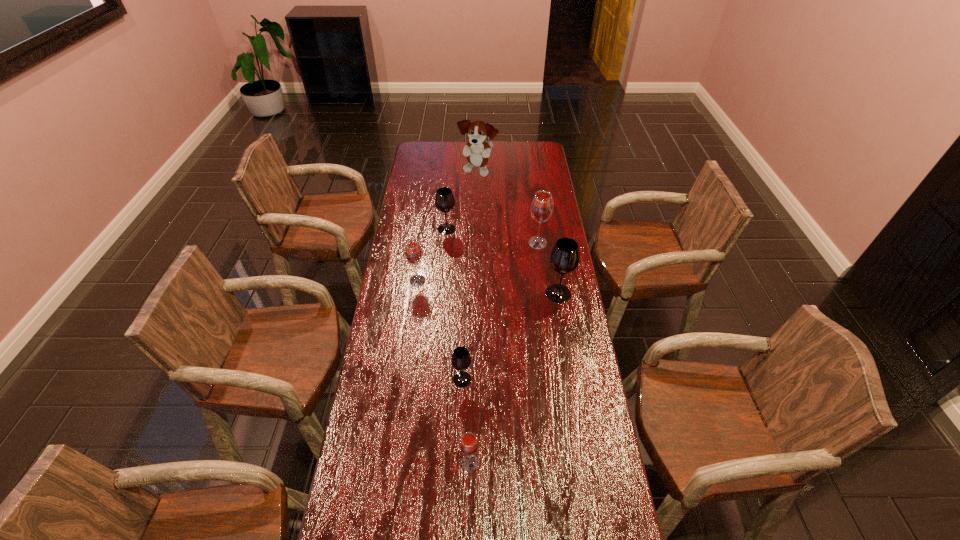
Locate an element on the screen. puppy is located at coordinates (477, 150).

Identify the location of brown puppy. The image size is (960, 540). (477, 150).

Locate an element on the screen. This screenshot has height=540, width=960. the fifth nearest object is located at coordinates (542, 205).

At what (x,y) coordinates should I click in order to perform the action: click on the second farthest wineglass. Please return your answer as a coordinate pair (x, y). The image size is (960, 540). Looking at the image, I should click on (542, 205).

At what (x,y) coordinates should I click in order to perform the action: click on the rightmost gray wineglass. Please return your answer as a coordinate pair (x, y). The image size is (960, 540). Looking at the image, I should click on (564, 258).

Find the location of a particular element. The height and width of the screenshot is (540, 960). the biggest gray wineglass is located at coordinates (564, 258).

The width and height of the screenshot is (960, 540). I want to click on the second smallest red wineglass, so click(x=413, y=252).

Identify the location of the leftmost red wineglass. (413, 252).

I want to click on the second wineglass from left to right, so click(x=444, y=200).

Where is `the farthest gray wineglass`? The image size is (960, 540). the farthest gray wineglass is located at coordinates (444, 200).